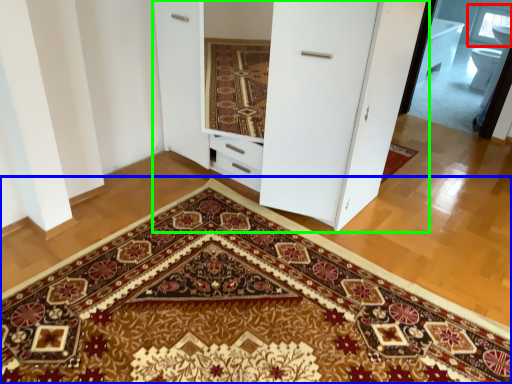
Question: Which object is positioned farthest from window (highlighted by a red box)? Select from doormat (highlighted by a blue box) and dresser (highlighted by a green box).

Choices:
 (A) doormat
 (B) dresser

Answer: (A)